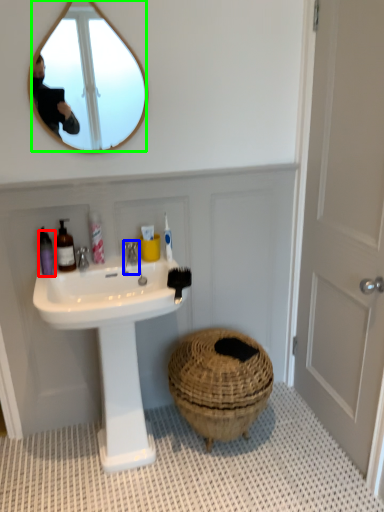
Question: Based on their relative distances, which object is nearer to toiletry (highlighted by a red box)? Choose from faucet (highlighted by a blue box) and mirror (highlighted by a green box).

Choices:
 (A) faucet
 (B) mirror

Answer: (A)